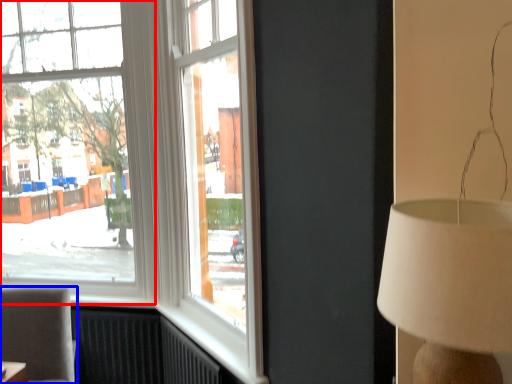
Question: Which object is further to the camera taking this photo, window (highlighted by a red box) or furniture (highlighted by a blue box)?

Choices:
 (A) window
 (B) furniture

Answer: (A)